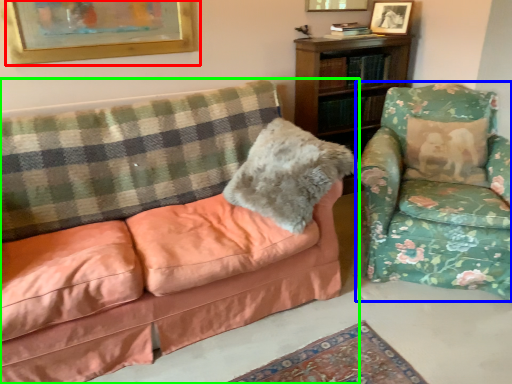
Question: Which is farther away from picture frame (highlighted by a red box)? chair (highlighted by a blue box) or studio couch (highlighted by a green box)?

Choices:
 (A) chair
 (B) studio couch

Answer: (A)